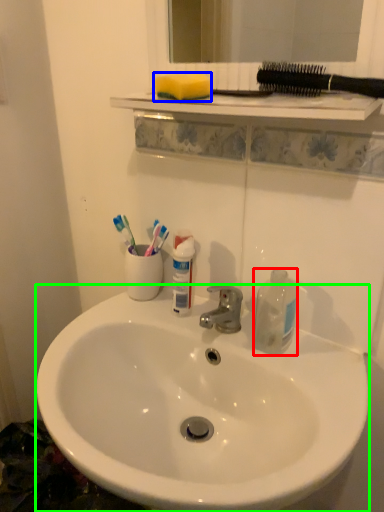
Question: Considering the real-world distances, which object is farthest from bottle (highlighted by a red box)? toothpick (highlighted by a blue box) or sink (highlighted by a green box)?

Choices:
 (A) toothpick
 (B) sink

Answer: (A)